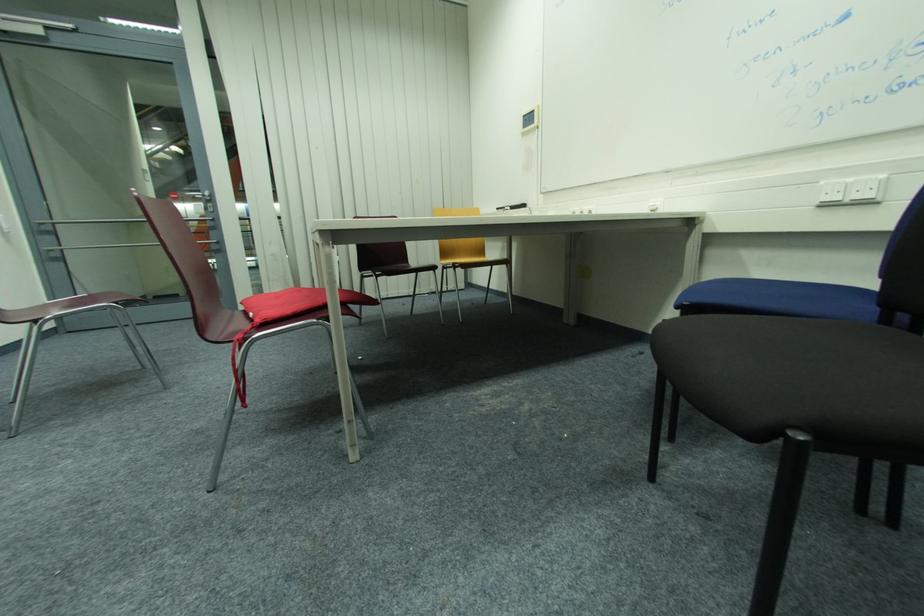
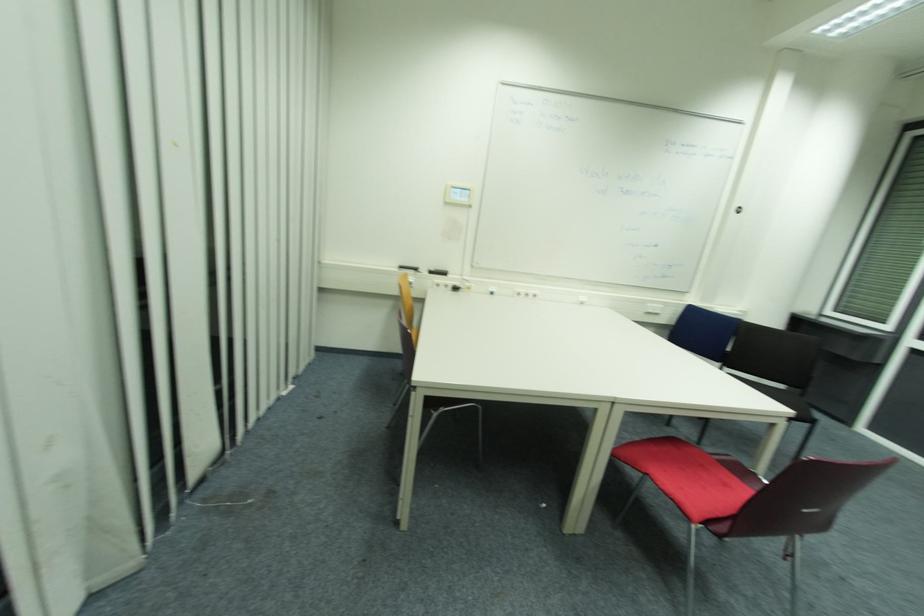
Find the pixel in the second image that matches the point at 855,180 in the first image.

(658, 306)